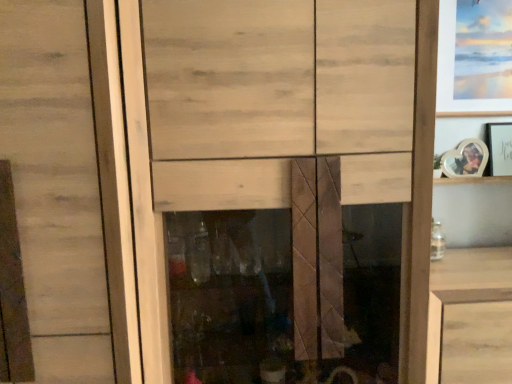
Question: From the image's perspective, is wooden heart-shaped photo frame at upper right, which is counted as the 1th picture frame, starting from the bottom, below wooden photo frame at upper right, the second picture frame ordered from the bottom?

Choices:
 (A) no
 (B) yes

Answer: (B)

Question: Does wooden heart-shaped photo frame at upper right, the 3th picture frame when ordered from top to bottom, lie behind wooden photo frame at upper right, placed as the 2th picture frame when sorted from top to bottom?

Choices:
 (A) no
 (B) yes

Answer: (A)

Question: Does wooden heart-shaped photo frame at upper right, which is counted as the 1th picture frame, starting from the bottom, turn towards wooden photo frame at upper right, placed as the 2th picture frame when sorted from top to bottom?

Choices:
 (A) no
 (B) yes

Answer: (A)

Question: Is wooden photo frame at upper right, the second picture frame ordered from the bottom, at the back of wooden heart-shaped photo frame at upper right, the 3th picture frame when ordered from top to bottom?

Choices:
 (A) yes
 (B) no

Answer: (B)

Question: Does wooden heart-shaped photo frame at upper right, which is counted as the 1th picture frame, starting from the bottom, have a lesser height compared to wooden photo frame at upper right, the second picture frame ordered from the bottom?

Choices:
 (A) no
 (B) yes

Answer: (B)

Question: Visually, is wooden photo frame at upper right, placed as the 2th picture frame when sorted from top to bottom, positioned to the left or to the right of wooden cabinet at lower right?

Choices:
 (A) right
 (B) left

Answer: (A)

Question: In terms of width, does wooden photo frame at upper right, the second picture frame ordered from the bottom, look wider or thinner when compared to wooden cabinet at lower right?

Choices:
 (A) thin
 (B) wide

Answer: (A)

Question: In terms of size, does wooden photo frame at upper right, the second picture frame ordered from the bottom, appear bigger or smaller than wooden cabinet at lower right?

Choices:
 (A) small
 (B) big

Answer: (A)

Question: From their relative heights in the image, would you say wooden photo frame at upper right, placed as the 2th picture frame when sorted from top to bottom, is taller or shorter than wooden cabinet at lower right?

Choices:
 (A) tall
 (B) short

Answer: (B)

Question: Is wooden frame at right taller or shorter than matte white picture frame at upper right, the 3th picture frame ordered from the bottom?

Choices:
 (A) tall
 (B) short

Answer: (B)

Question: Looking at their shapes, would you say wooden frame at right is wider or thinner than matte white picture frame at upper right, the 3th picture frame ordered from the bottom?

Choices:
 (A) wide
 (B) thin

Answer: (B)

Question: From the image's perspective, is wooden frame at right above or below matte white picture frame at upper right, the 3th picture frame ordered from the bottom?

Choices:
 (A) below
 (B) above

Answer: (A)

Question: Is wooden frame at right situated inside matte white picture frame at upper right, which appears as the first picture frame when viewed from the top, or outside?

Choices:
 (A) inside
 (B) outside

Answer: (B)

Question: From the image's perspective, is matte white picture frame at upper right, which appears as the first picture frame when viewed from the top, above or below wooden heart-shaped photo frame at upper right, which is counted as the 1th picture frame, starting from the bottom?

Choices:
 (A) above
 (B) below

Answer: (A)

Question: Considering their positions, is matte white picture frame at upper right, which appears as the first picture frame when viewed from the top, located in front of or behind wooden heart-shaped photo frame at upper right, which is counted as the 1th picture frame, starting from the bottom?

Choices:
 (A) behind
 (B) front

Answer: (B)